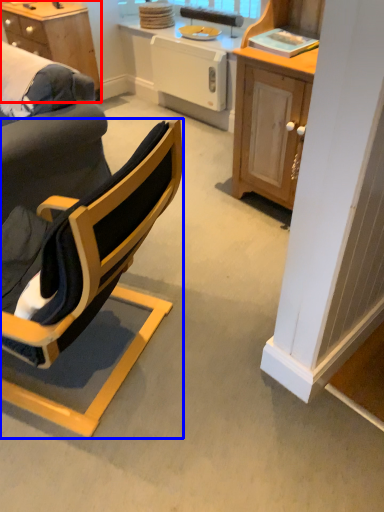
Question: Which object appears farthest to the camera in this image, desk (highlighted by a red box) or chair (highlighted by a blue box)?

Choices:
 (A) desk
 (B) chair

Answer: (A)